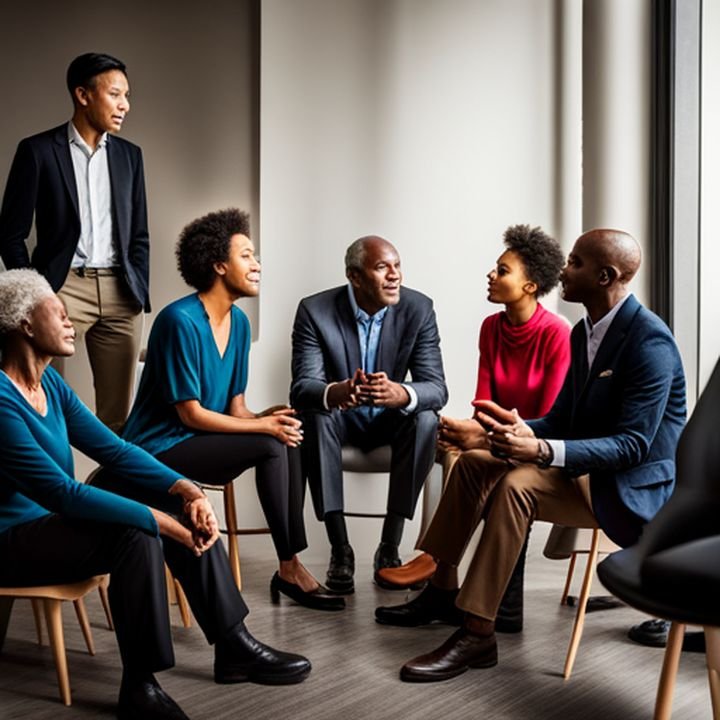
This screenshot has width=720, height=720. In order to click on chair legs in this screenshot , I will do `click(60, 628)`, `click(39, 613)`, `click(81, 613)`, `click(99, 595)`, `click(186, 612)`, `click(234, 567)`, `click(588, 589)`, `click(672, 665)`, `click(708, 649)`, `click(570, 561)`.